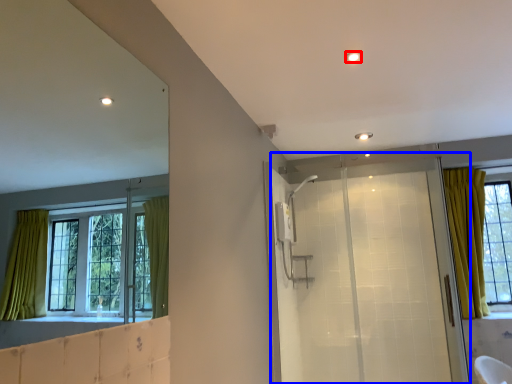
Question: Which point is further to the camera, light (highlighted by a red box) or screen door (highlighted by a blue box)?

Choices:
 (A) light
 (B) screen door

Answer: (B)